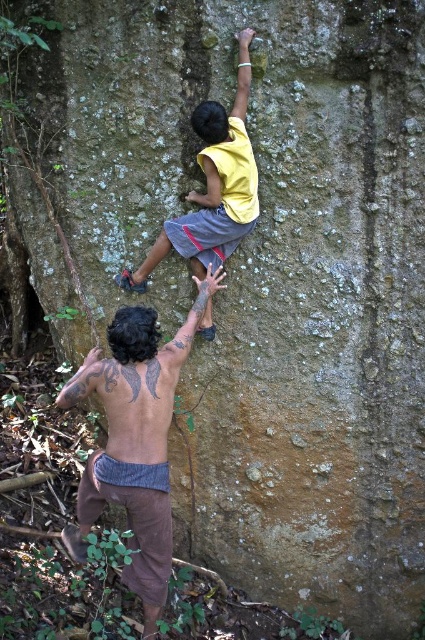
Question: Is brown textured shorts at lower left to the left of yellow matte shirt at upper center from the viewer's perspective?

Choices:
 (A) no
 (B) yes

Answer: (B)

Question: Which object appears farthest from the camera in this image?

Choices:
 (A) yellow matte shirt at upper center
 (B) brown textured shorts at lower left

Answer: (A)

Question: Which of the following is the farthest from the observer?

Choices:
 (A) (255, 208)
 (B) (161, 360)

Answer: (A)

Question: Can you confirm if brown textured shorts at lower left is positioned below yellow matte shirt at upper center?

Choices:
 (A) yes
 (B) no

Answer: (A)

Question: Can you confirm if brown textured shorts at lower left is bigger than yellow matte shirt at upper center?

Choices:
 (A) yes
 (B) no

Answer: (A)